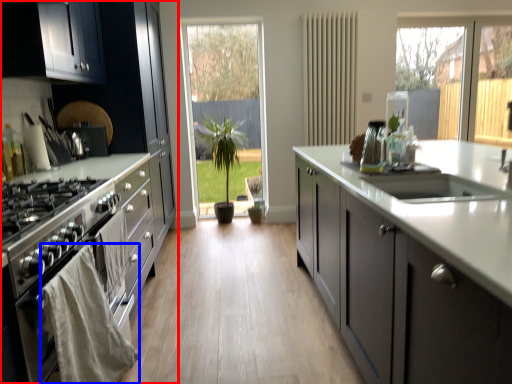
Question: Among these objects, which one is nearest to the camera, cabinetry (highlighted by a red box) or material (highlighted by a blue box)?

Choices:
 (A) cabinetry
 (B) material

Answer: (B)